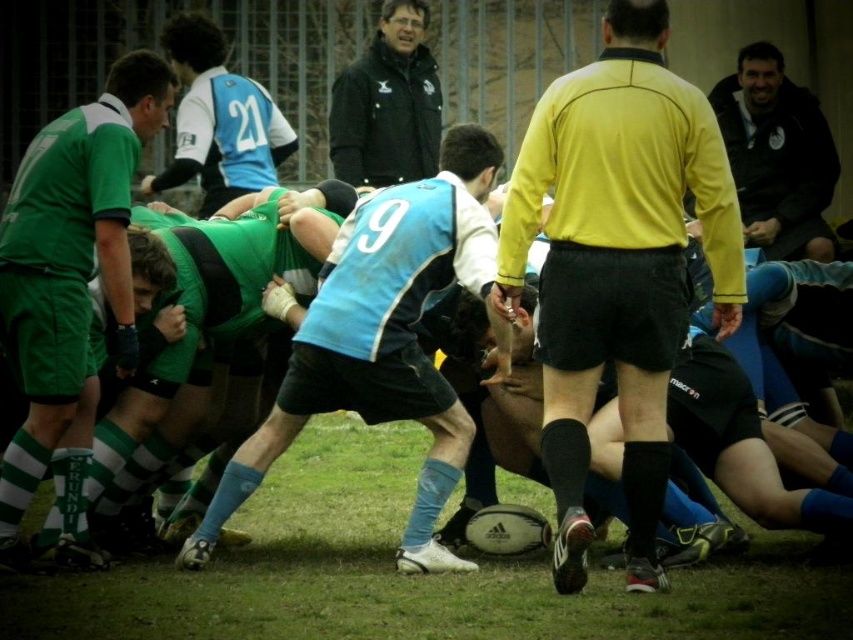
Question: Does blue matte jersey at center have a smaller size compared to green matte shorts at left?

Choices:
 (A) yes
 (B) no

Answer: (B)

Question: Based on their relative distances, which object is farther from the green matte shorts at left?

Choices:
 (A) black jacket at upper center
 (B) blue jersey at center
 (C) yellow matte shirt at center
 (D) blue matte jersey at center

Answer: (A)

Question: Can you confirm if green matte shorts at left is positioned below black jacket at upper center?

Choices:
 (A) yes
 (B) no

Answer: (A)

Question: Which of the following is the farthest from the observer?

Choices:
 (A) (607, 348)
 (B) (370, 88)
 (C) (262, 180)

Answer: (B)

Question: Which point is farther from the camera taking this photo?

Choices:
 (A) (792, 136)
 (B) (479, 221)

Answer: (A)

Question: Where is black leather jacket at upper right located in relation to black jacket at upper center in the image?

Choices:
 (A) above
 (B) below

Answer: (B)